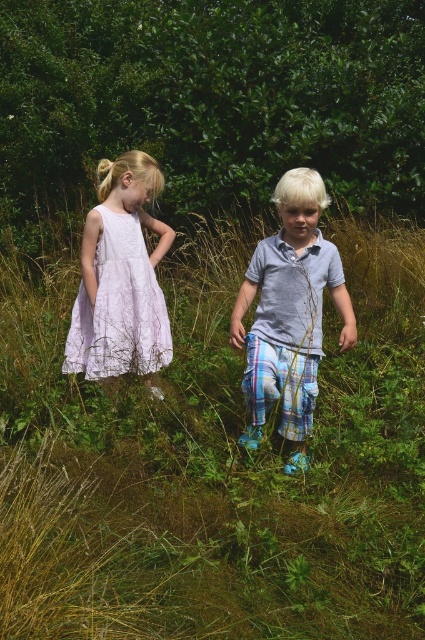
Question: Which point is closer to the camera?

Choices:
 (A) green grassy at center
 (B) light blue plaid pants at center
 (C) lavender lace dress at left

Answer: (A)

Question: Can you confirm if green grassy at center is wider than light blue plaid pants at center?

Choices:
 (A) no
 (B) yes

Answer: (B)

Question: Which is nearer to the green grassy at center?

Choices:
 (A) light blue plaid pants at center
 (B) lavender lace dress at left

Answer: (B)

Question: Considering the relative positions of green grassy at center and lavender lace dress at left in the image provided, where is green grassy at center located with respect to lavender lace dress at left?

Choices:
 (A) above
 (B) below

Answer: (B)

Question: Which of these objects is positioned closest to the light blue plaid pants at center?

Choices:
 (A) green grassy at center
 (B) lavender lace dress at left

Answer: (B)

Question: Is light blue plaid pants at center behind lavender lace dress at left?

Choices:
 (A) no
 (B) yes

Answer: (A)